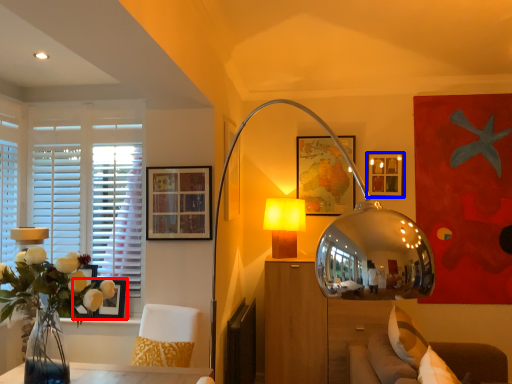
Question: Among these objects, which one is nearest to the camera, picture frame (highlighted by a red box) or picture frame (highlighted by a blue box)?

Choices:
 (A) picture frame
 (B) picture frame

Answer: (A)